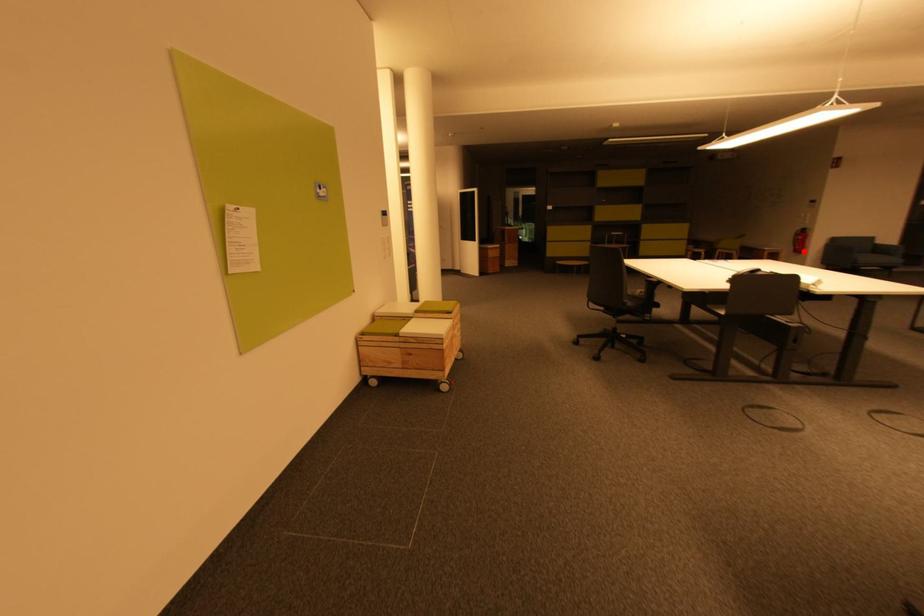
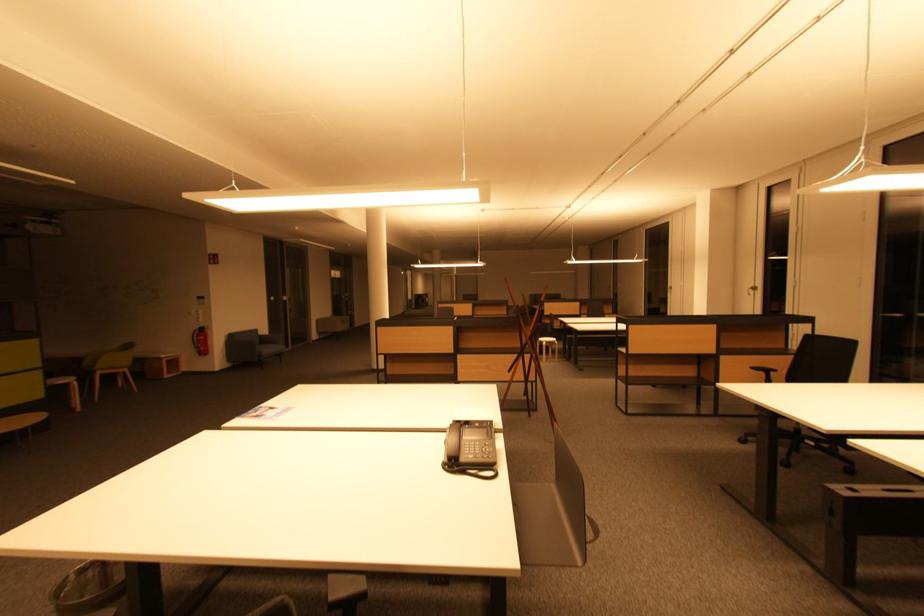
The point at the highlighted location is marked in the first image. Where is the corresponding point in the second image?

(207, 353)